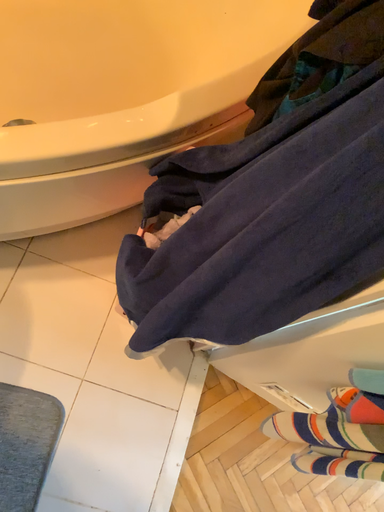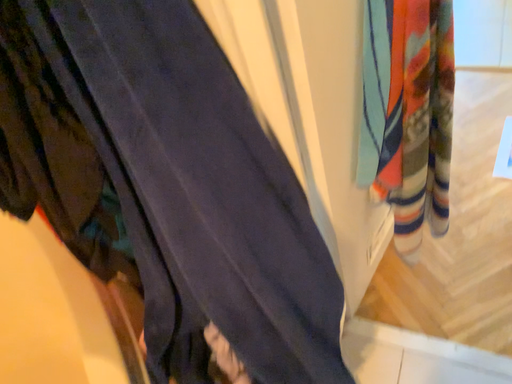
Question: How did the camera likely rotate when shooting the video?

Choices:
 (A) rotated upward
 (B) rotated downward

Answer: (A)